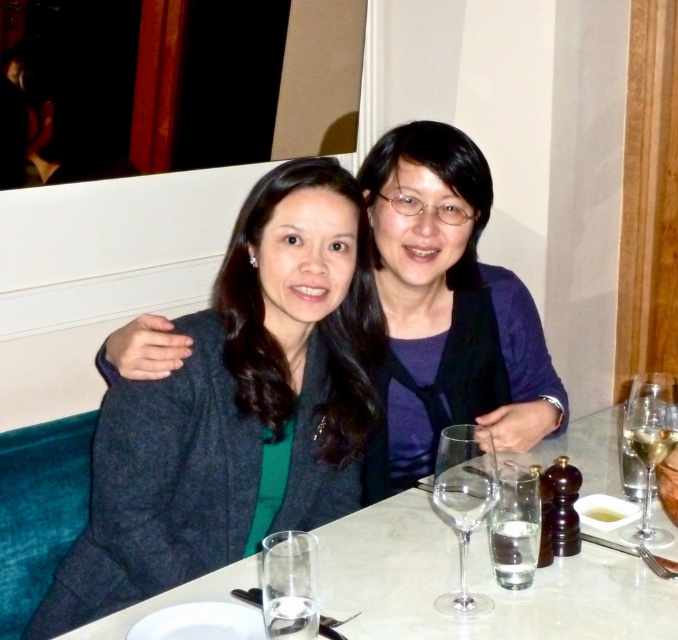
Question: From the image, what is the correct spatial relationship of matte gray blazer at center in relation to clear glass at lower center?

Choices:
 (A) above
 (B) below

Answer: (A)

Question: Estimate the real-world distances between objects in this image. Which object is closer to the transparent glass wine glass at center?

Choices:
 (A) matte gray blazer at center
 (B) white marble table at center
 (C) clear glass at lower center

Answer: (B)

Question: Which of these objects is positioned closest to the clear glass at lower center?

Choices:
 (A) clear glass wine glass at right
 (B) matte black blazer at center
 (C) transparent glass wine glass at center

Answer: (C)

Question: Does white marble table at center come behind transparent glass wine glass at center?

Choices:
 (A) yes
 (B) no

Answer: (B)

Question: Does matte gray blazer at center have a lesser width compared to white marble table at center?

Choices:
 (A) yes
 (B) no

Answer: (A)

Question: Which object is the farthest from the transparent glass wine glass at center?

Choices:
 (A) clear glass wine glass at right
 (B) matte gray blazer at center

Answer: (B)